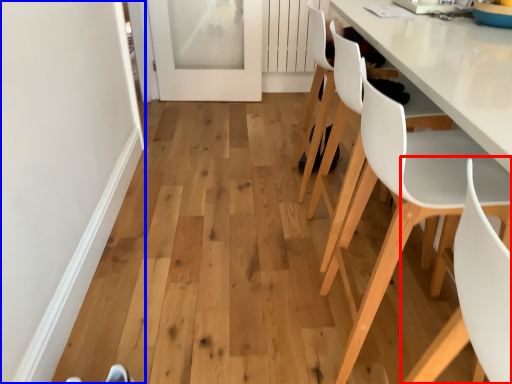
Question: Which point is further to the camera, chair (highlighted by a red box) or door (highlighted by a blue box)?

Choices:
 (A) chair
 (B) door

Answer: (B)